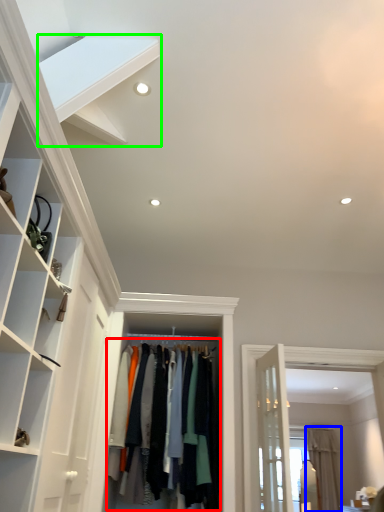
Question: Based on their relative distances, which object is farther from clothing (highlighted by a red box)? Choose from curtain (highlighted by a blue box) and stairs (highlighted by a green box).

Choices:
 (A) curtain
 (B) stairs

Answer: (A)